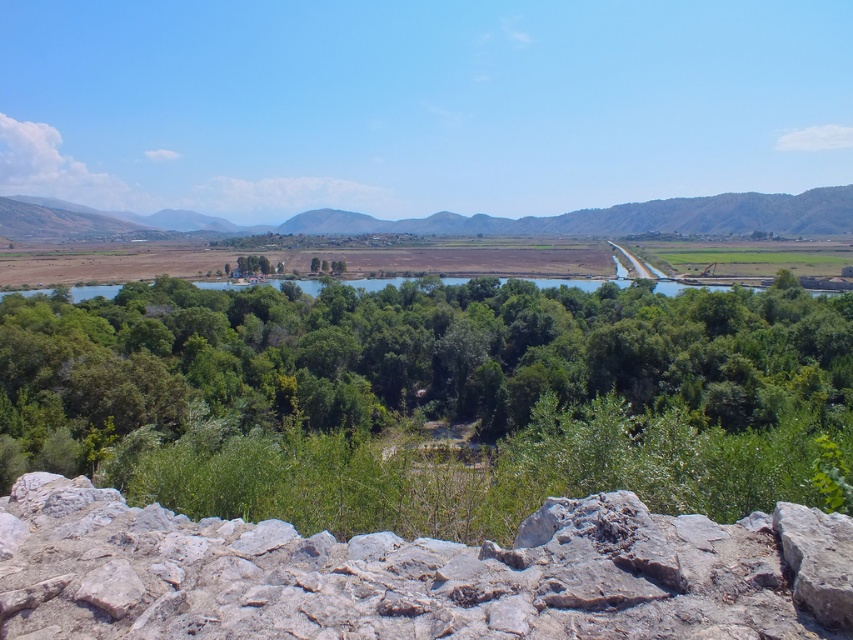
Does gray rough stone at bottom lie behind brown rocky mountain at center?

No, gray rough stone at bottom is closer to the viewer.

Who is more forward, (x=840, y=580) or (x=582, y=234)?

Point (x=840, y=580) is more forward.

Where is `gray rough stone at bottom`? The image size is (853, 640). gray rough stone at bottom is located at coordinates click(415, 573).

The height and width of the screenshot is (640, 853). Identify the location of green leafy trees at center. (432, 397).

Is green leafy trees at center below brown rocky mountain at center?

Yes, green leafy trees at center is below brown rocky mountain at center.

The width and height of the screenshot is (853, 640). What do you see at coordinates (432, 397) in the screenshot?
I see `green leafy trees at center` at bounding box center [432, 397].

At what (x,y) coordinates should I click in order to perform the action: click on green leafy trees at center. Please return your answer as a coordinate pair (x, y). The image size is (853, 640). Looking at the image, I should click on (432, 397).

Is green leafy trees at center above gray rough stone at bottom?

Incorrect, green leafy trees at center is not positioned above gray rough stone at bottom.

Is green leafy trees at center further to the viewer compared to gray rough stone at bottom?

That is True.

Who is more distant from viewer, (x=351, y=504) or (x=498, y=586)?

Point (x=351, y=504)

You are a GUI agent. You are given a task and a screenshot of the screen. Output one action in this format:
    pyautogui.click(x=<x>, y=<y>)
    Task: Click on the green leafy trees at center
    The width and height of the screenshot is (853, 640).
    Given the screenshot: What is the action you would take?
    point(432,397)